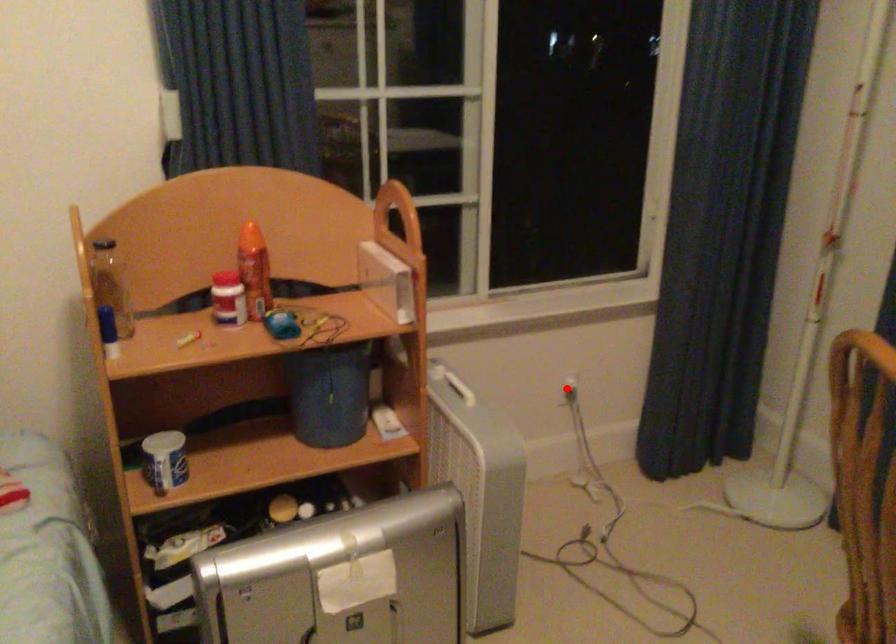
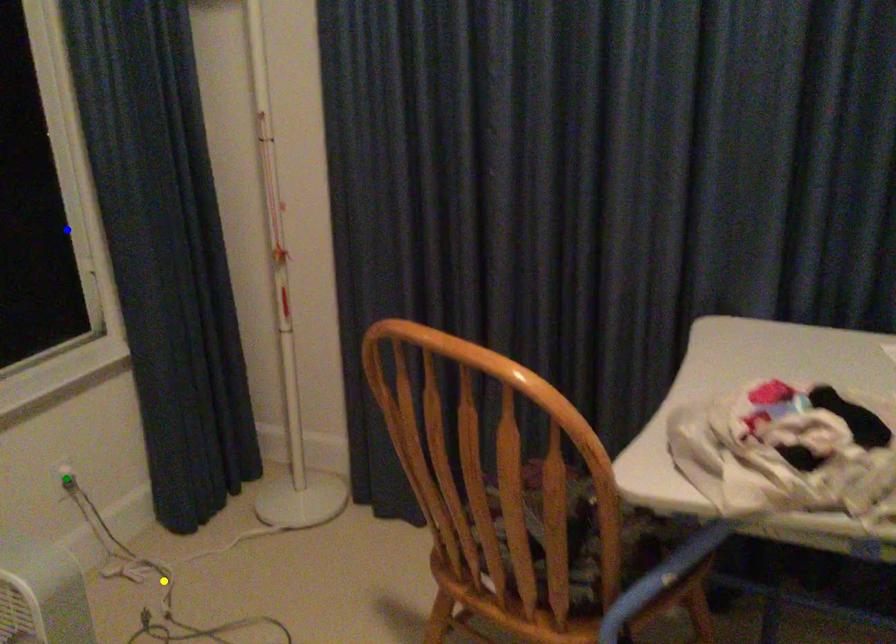
Question: I am providing you with two images of the same scene from different viewpoints. A red point is marked on the first image. You are given multiple points on the second image. Which spot in image 2 lines up with the point in image 1?

Choices:
 (A) yellow point
 (B) green point
 (C) blue point

Answer: (B)